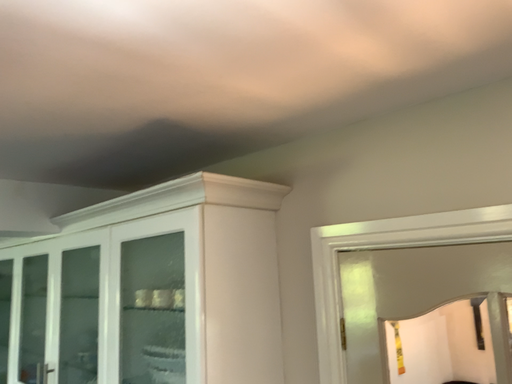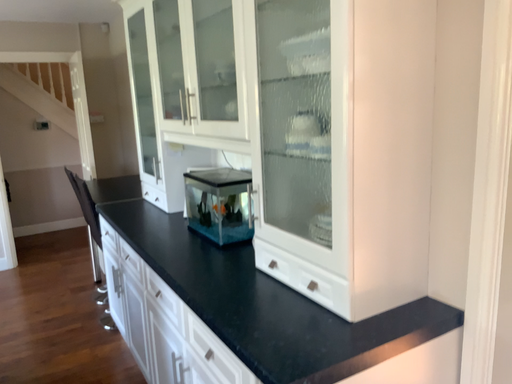
Question: Which way did the camera rotate in the video?

Choices:
 (A) rotated left
 (B) rotated right

Answer: (A)